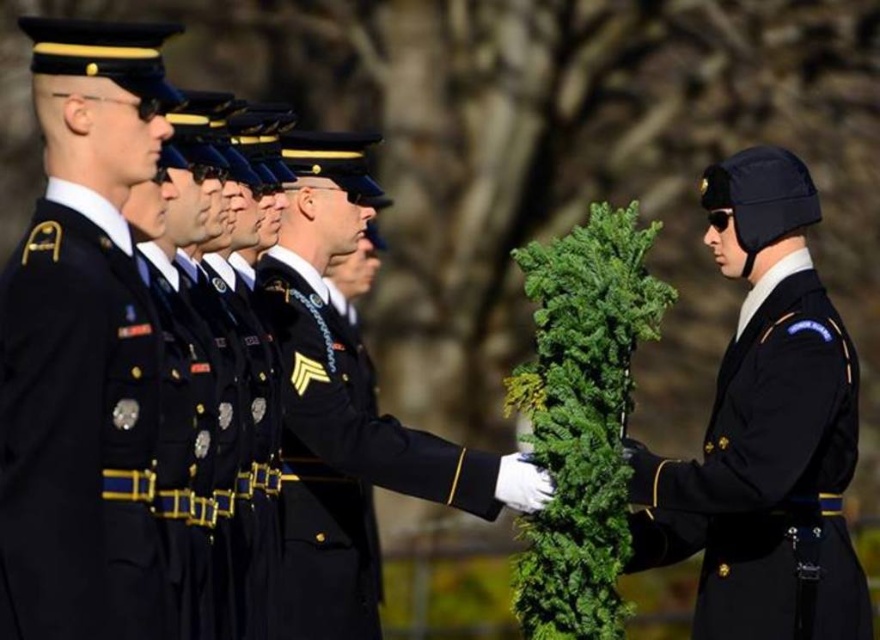
Is dark blue woolen uniform at center thinner than black wool uniform at right?

Indeed, dark blue woolen uniform at center has a lesser width compared to black wool uniform at right.

Is point (130, 275) positioned before point (798, 294)?

Yes, it is.

Looking at this image, who is more forward, (132, 618) or (794, 513)?

Positioned in front is point (132, 618).

Find the location of a particular element. This screenshot has width=880, height=640. dark blue woolen uniform at center is located at coordinates (77, 429).

Can you confirm if black wool uniform at right is positioned above shiny black uniform at center?

Actually, black wool uniform at right is below shiny black uniform at center.

Between point (776, 355) and point (309, 502), which one is positioned behind?

Positioned behind is point (309, 502).

Where is `black wool uniform at right`? The height and width of the screenshot is (640, 880). black wool uniform at right is located at coordinates (766, 476).

Who is more distant from viewer, (92, 595) or (316, 564)?

The point (316, 564) is more distant.

Locate an element on the screen. dark blue woolen uniform at center is located at coordinates (77, 429).

Does point (97, 291) come farther from viewer compared to point (431, 449)?

No, (97, 291) is closer to viewer.

The height and width of the screenshot is (640, 880). I want to click on dark blue woolen uniform at center, so click(x=77, y=429).